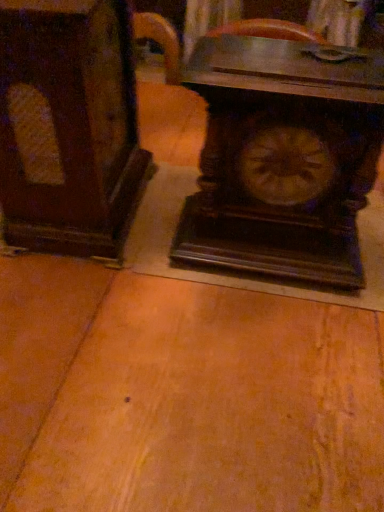
Find the location of `vacant space in front of dark wood cabinet at left`. vacant space in front of dark wood cabinet at left is located at coordinates (x=102, y=302).